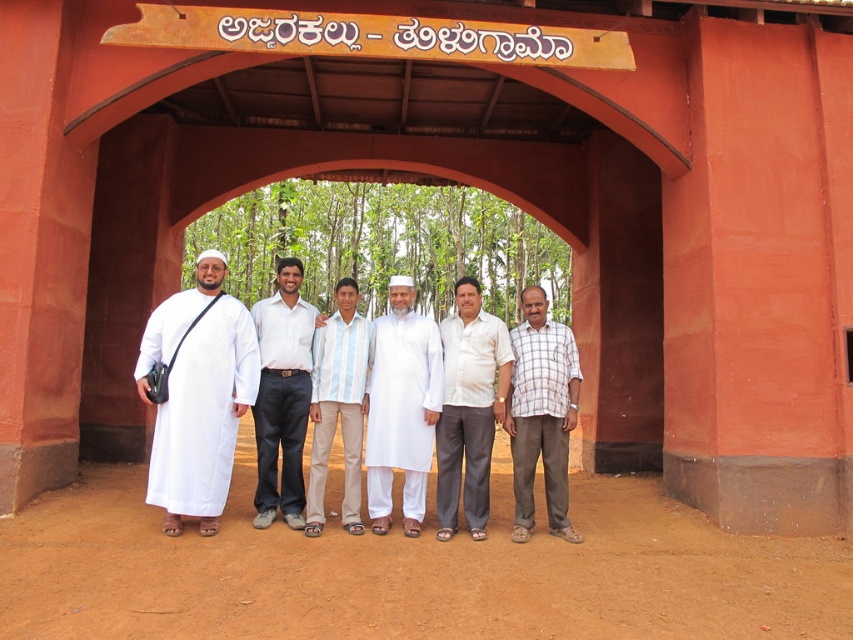
You are a photographer trying to capture a group photo of the white cotton shirt at center and the striped cotton shirt at center. The camera you are using has a minimum focus distance of 12 inches. Will you be able to focus on both subjects clearly?

The white cotton shirt at center and striped cotton shirt at center are 11.97 inches apart, which is less than the camera minimum focus distance of 12 inches. Therefore, the camera may not be able to focus on both subjects clearly.

Consider the image. You are standing in front of the archway and want to place a small decoration exactly halfway between the two points marked as point [283,444] and point [331,326]. Will the decoration be closer to the archway or further away from it compared to the two points?

The decoration placed halfway between point [283,444] and point [331,326] will be closer to the archway than both points because point [283,444] is closer to the viewer than point [331,326]. Since the halfway point is between them, it would be positioned closer to the archway compared to the original points.